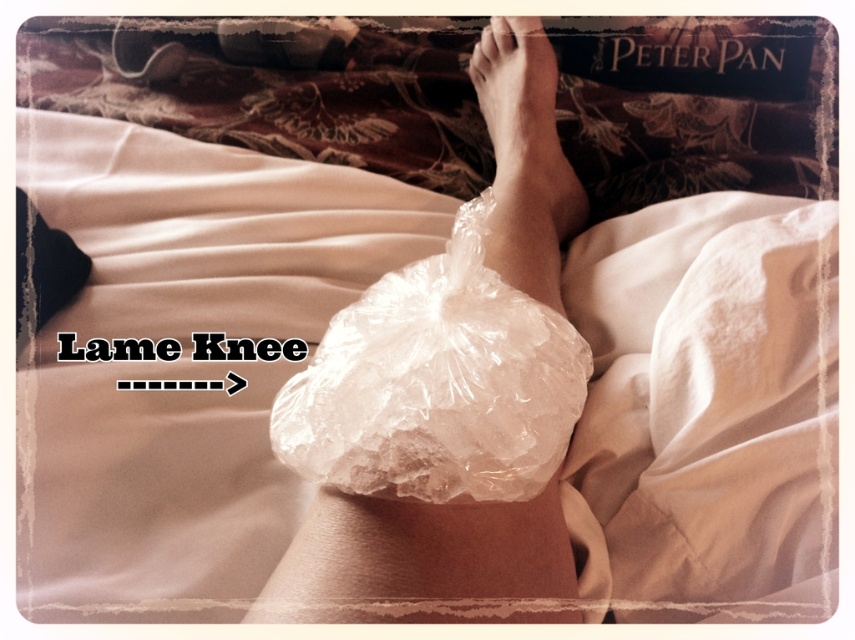
You are a photographer trying to capture a closeup of the clear plastic ice pack at center. If your camera is positioned 27.25 inches away from the ice pack, will you be able to focus on it clearly?

Yes, since the camera is positioned exactly 27.25 inches away from the clear plastic ice pack at center, which is the required distance for clear focus.

You are a physical therapist observing a patient with a knee injury. The patient has a translucent plastic bag at center and a clear plastic ice pack at center on their leg. Which object is positioned lower on the leg?

The translucent plastic bag at center is positioned lower on the leg than the clear plastic ice pack at center, as it is below it.